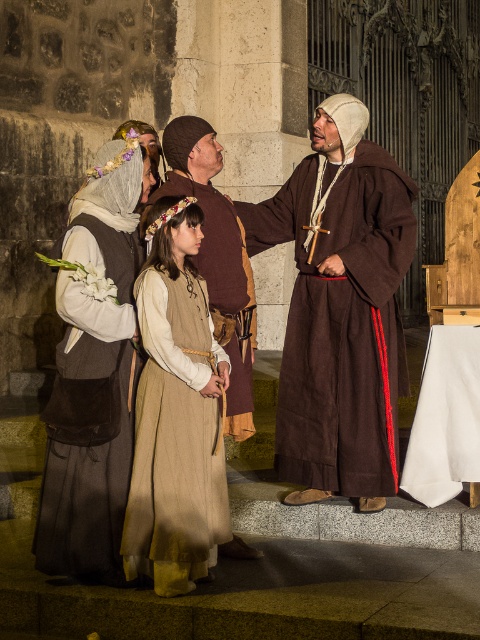
Question: Is brown linen robe at center thinner than matte brown dress at left?

Choices:
 (A) no
 (B) yes

Answer: (A)

Question: Is brown linen robe at center smaller than matte brown dress at left?

Choices:
 (A) yes
 (B) no

Answer: (B)

Question: Which object is the closest to the matte brown dress at left?

Choices:
 (A) brown linen robe at center
 (B) beige woolen dress at center

Answer: (B)

Question: Estimate the real-world distances between objects in this image. Which object is closer to the beige woolen dress at center?

Choices:
 (A) brown linen robe at center
 (B) matte brown dress at left

Answer: (B)

Question: Observing the image, what is the correct spatial positioning of brown linen robe at center in reference to matte brown dress at left?

Choices:
 (A) below
 (B) above

Answer: (B)

Question: Which object is farther from the camera taking this photo?

Choices:
 (A) brown linen robe at center
 (B) matte brown dress at left
 (C) beige woolen dress at center

Answer: (A)